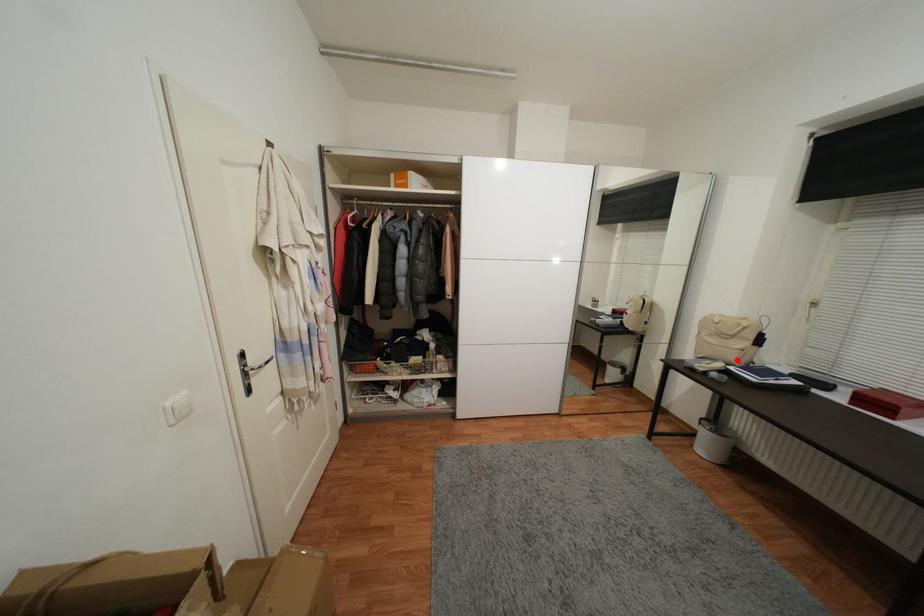
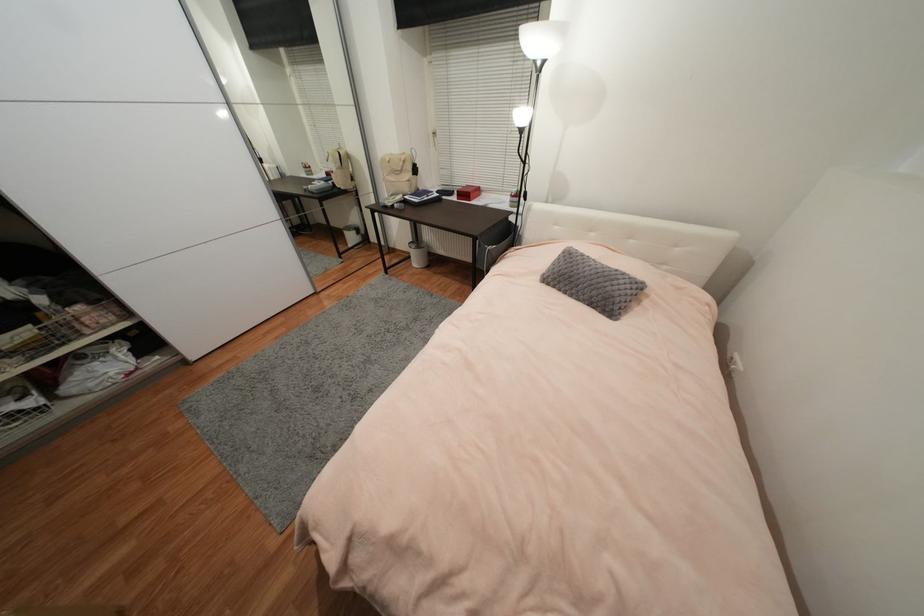
Where in the second image is the point corresponding to the highlighted location from the first image?

(410, 191)